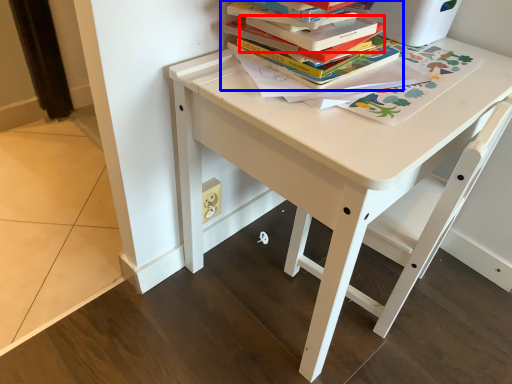
Question: Which object appears farthest to the camera in this image, paperback book (highlighted by a red box) or book (highlighted by a blue box)?

Choices:
 (A) paperback book
 (B) book

Answer: (B)